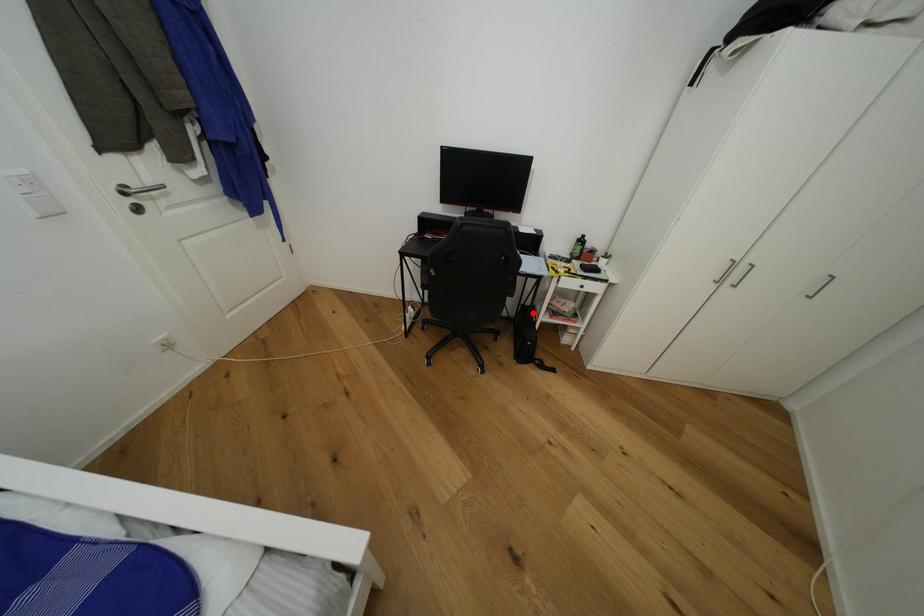
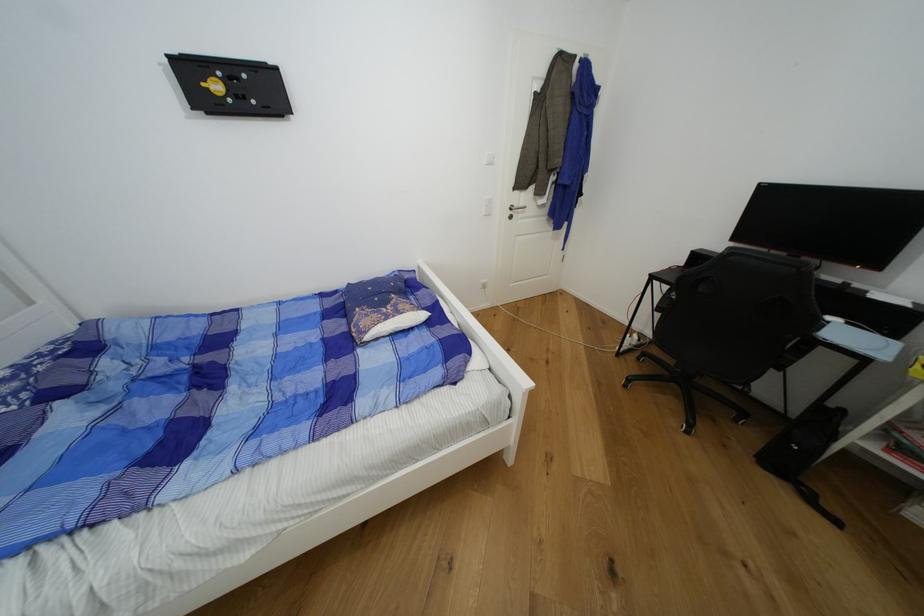
Where in the second image is the point corresponding to the highlighted location from the first image?

(833, 418)